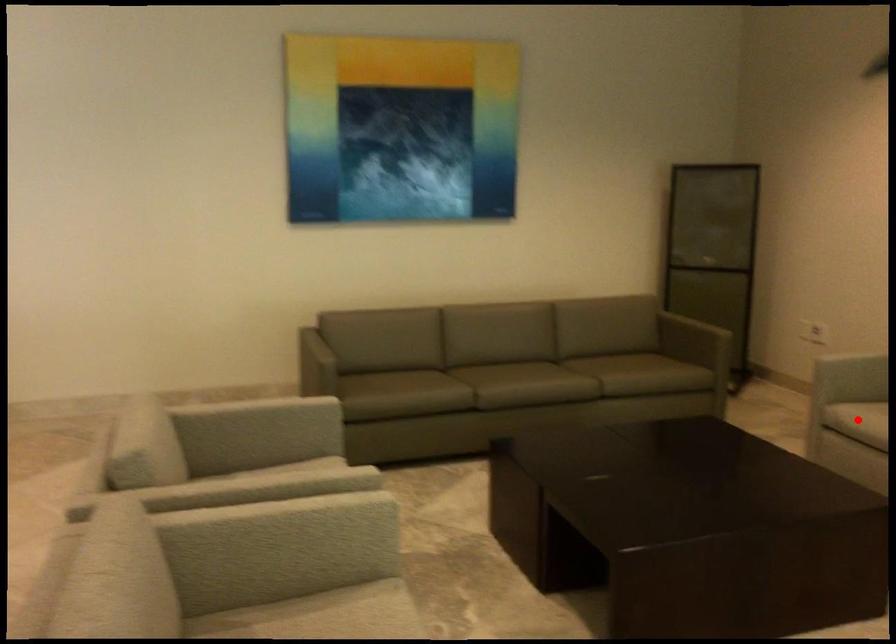
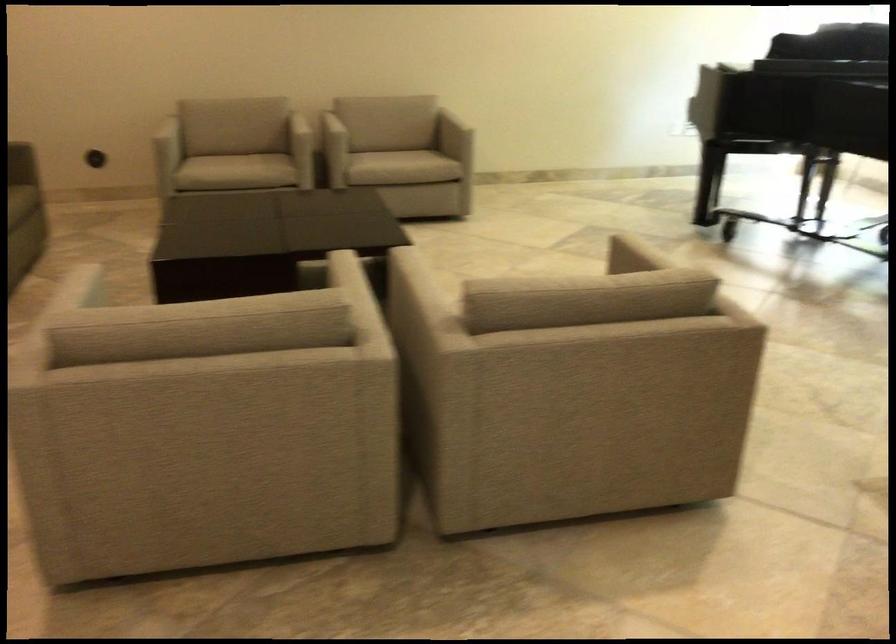
Find the pixel in the second image that matches the highlighted location in the first image.

(210, 167)